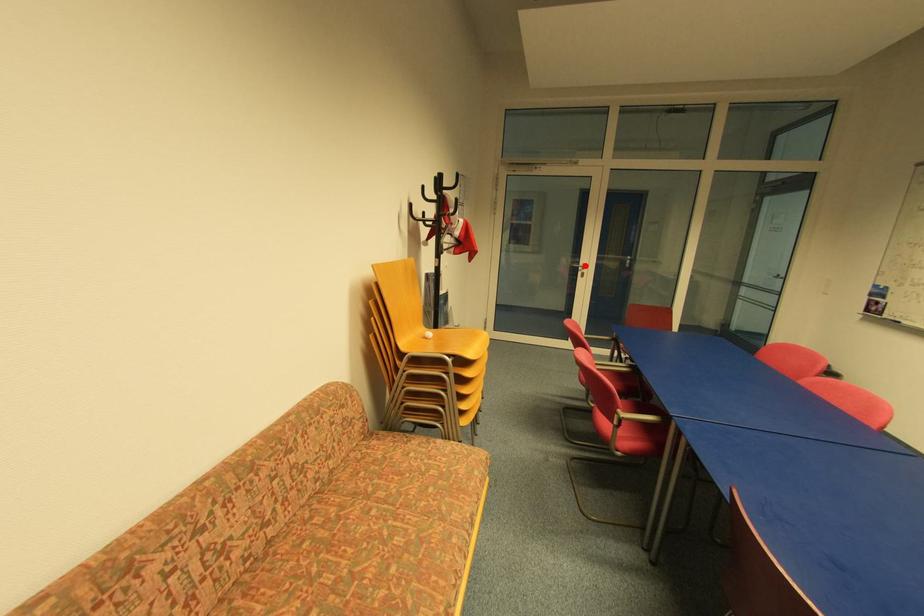
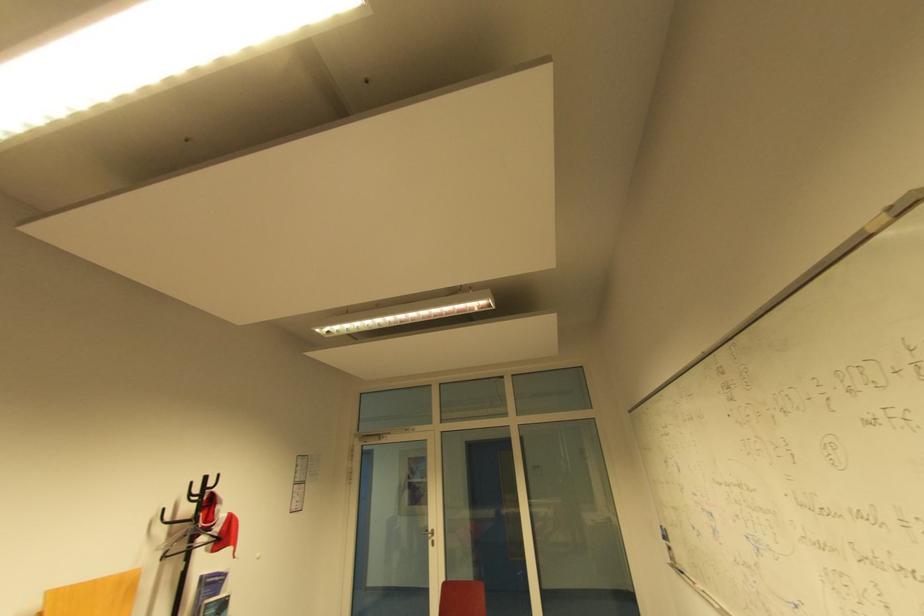
Question: I am providing you with two images of the same scene from different viewpoints. In image1, a red point is highlighted. Considering the same 3D point in image2, which of the following is correct?

Choices:
 (A) It is closer
 (B) It is farther

Answer: (B)